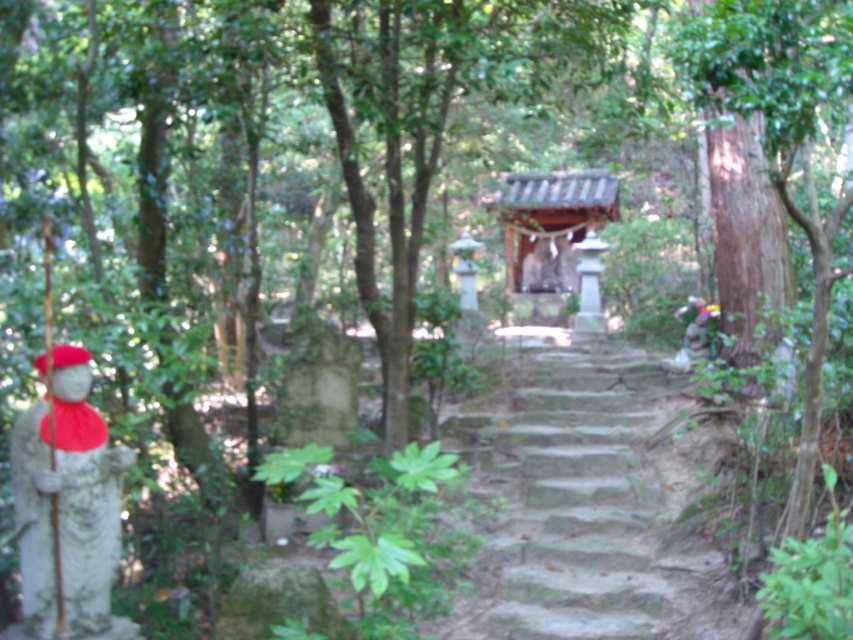
You are a delivery person carrying a package that requires a 3 meter clearance to pass safely. You need to navigate through the path between the stone steps at center and the smooth stone statue at left. Can you safely pass through this area with your package?

The distance between the stone steps at center and the smooth stone statue at left is 2.69 meters. Since the required clearance is 3 meters, the delivery person cannot safely pass through this area with the package.

You are a hiker carrying a heavy backpack and need to climb the stone steps at center. There is a smooth stone statue at left nearby. Which object is closer to the ground?

The stone steps at center are closer to the ground than the smooth stone statue at left because the stone steps at center is positioned under the smooth stone statue at left.